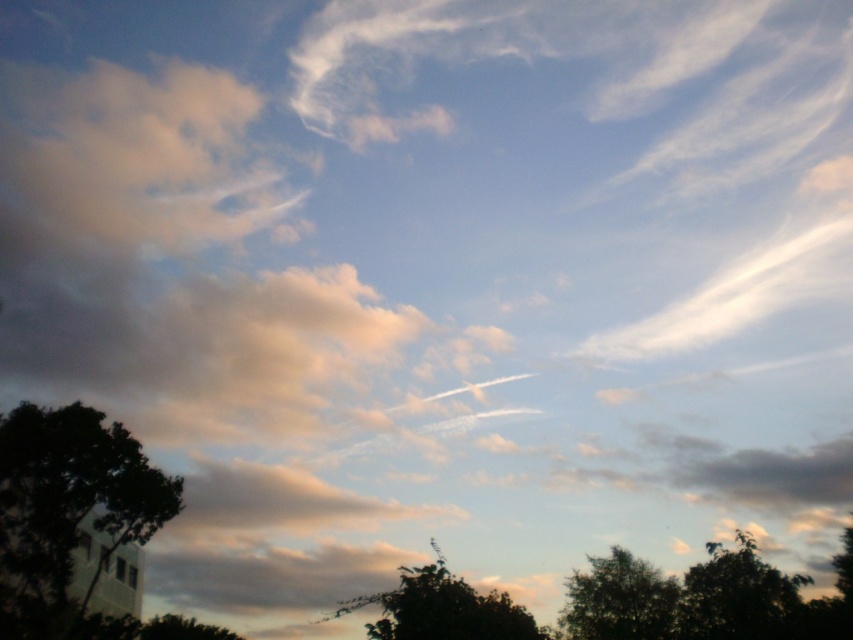
Does dark green leafy tree at lower right have a larger size compared to green leafy tree at lower center?

Yes, dark green leafy tree at lower right is bigger than green leafy tree at lower center.

Does dark green leafy tree at lower right have a greater height compared to green leafy tree at lower center?

Indeed, dark green leafy tree at lower right has a greater height compared to green leafy tree at lower center.

Is point (706, 614) behind point (410, 605)?

Yes, point (706, 614) is farther from viewer.

I want to click on dark green leafy tree at lower right, so click(740, 596).

Which is more to the left, dark green leafy tree at lower left or green leafy tree at lower center?

dark green leafy tree at lower left is more to the left.

Is dark green leafy tree at lower left to the right of green leafy tree at lower center from the viewer's perspective?

Incorrect, dark green leafy tree at lower left is not on the right side of green leafy tree at lower center.

The image size is (853, 640). Identify the location of dark green leafy tree at lower left. (71, 508).

Who is more distant from viewer, (x=126, y=490) or (x=614, y=586)?

The point (x=614, y=586) is more distant.

Does dark green leafy tree at lower left come behind green leafy tree at lower right?

No, dark green leafy tree at lower left is closer to the viewer.

Who is more forward, (25, 502) or (665, 620)?

Point (25, 502) is in front.

You are a GUI agent. You are given a task and a screenshot of the screen. Output one action in this format:
    pyautogui.click(x=<x>, y=<y>)
    Task: Click on the dark green leafy tree at lower left
    
    Given the screenshot: What is the action you would take?
    pyautogui.click(x=71, y=508)